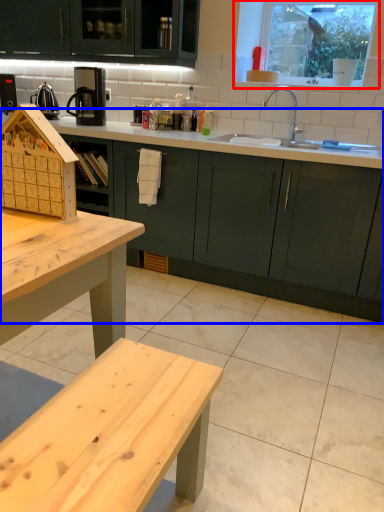
Question: Which point is closer to the camera, window (highlighted by a red box) or countertop (highlighted by a blue box)?

Choices:
 (A) window
 (B) countertop

Answer: (B)